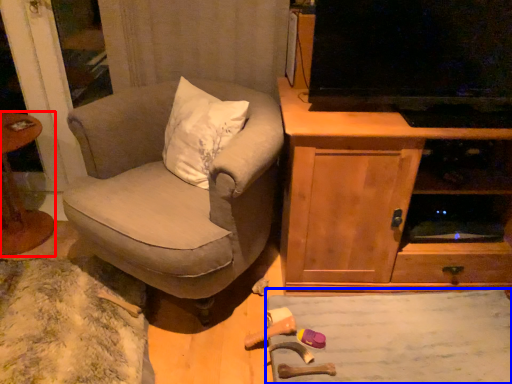
Question: Among these objects, which one is farthest to the camera, table (highlighted by a red box) or plain (highlighted by a blue box)?

Choices:
 (A) table
 (B) plain

Answer: (A)